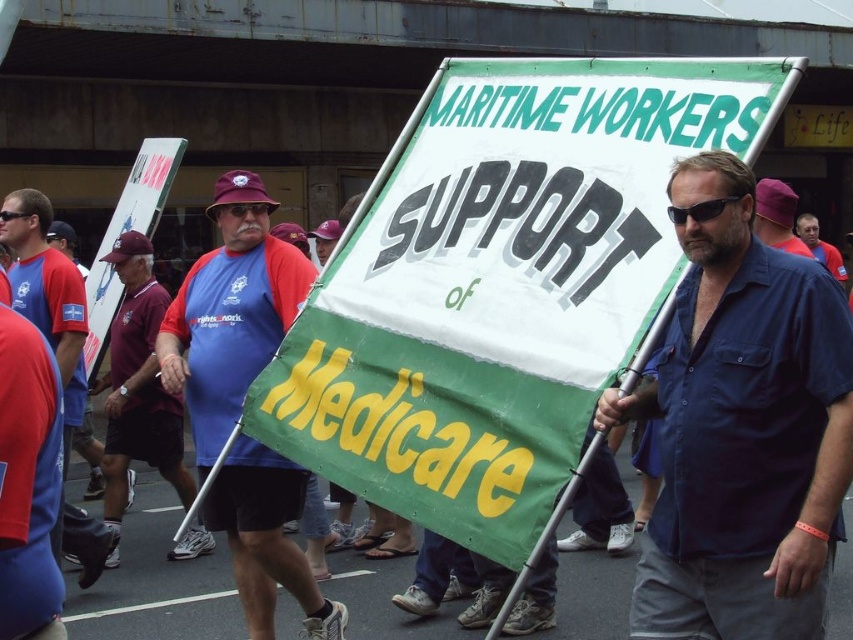
Question: Can you confirm if blue fabric shirt at center is bigger than purple fabric cap at upper center?

Choices:
 (A) yes
 (B) no

Answer: (A)

Question: Does blue cotton shirt at center have a larger size compared to blue shirt at center?

Choices:
 (A) yes
 (B) no

Answer: (A)

Question: Is blue fabric shirt at center thinner than blue shirt at center?

Choices:
 (A) no
 (B) yes

Answer: (A)

Question: Which object is the closest to the blue cotton shirt at center?

Choices:
 (A) blue fabric shirt at center
 (B) red fabric shirt at left
 (C) maroon fabric shirt at left

Answer: (A)

Question: Which of the following is the farthest from the observer?

Choices:
 (A) (239, 486)
 (B) (782, 410)
 (C) (74, 541)

Answer: (C)

Question: Which of the following is the farthest from the observer?

Choices:
 (A) (68, 541)
 (B) (129, 259)
 (C) (793, 202)
 (D) (665, 604)

Answer: (B)